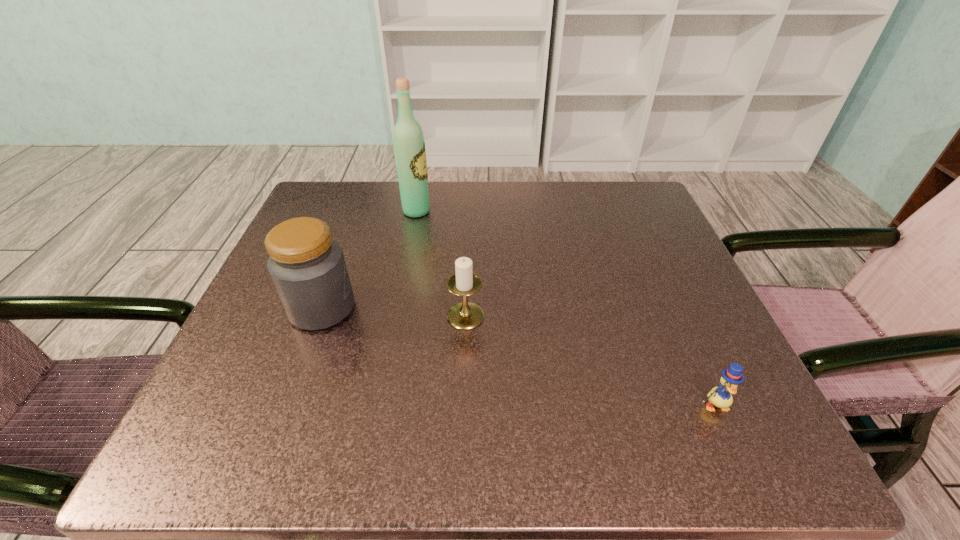
Where is `the tallest object`? the tallest object is located at coordinates (409, 145).

Find the location of a particular element. Image resolution: width=960 pixels, height=540 pixels. the farthest object is located at coordinates (409, 145).

Identify the location of the leftmost object. The width and height of the screenshot is (960, 540). click(307, 267).

The height and width of the screenshot is (540, 960). I want to click on the third shortest object, so click(307, 267).

Where is `candle holder`? candle holder is located at coordinates (465, 315).

Identify the location of the third object from left to right. This screenshot has height=540, width=960. (465, 315).

Find the location of a particular element. the nearest object is located at coordinates (721, 397).

Find the location of `the rightmost object`. the rightmost object is located at coordinates (721, 397).

Identify the location of vacant region located on the front-facing side of the wine bottle. (582, 211).

This screenshot has height=540, width=960. Identify the location of free spot located on the surface of the second tallest object near the warning symbol. (577, 308).